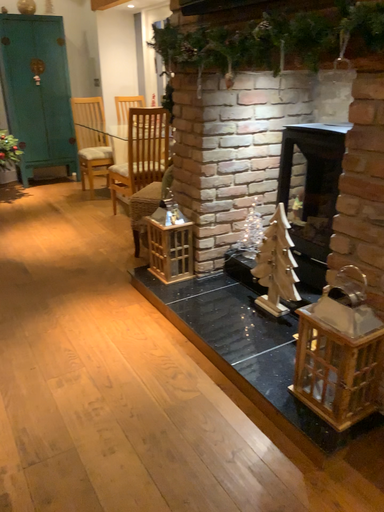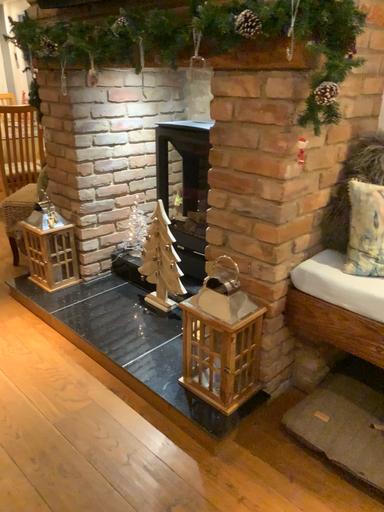
Question: How did the camera likely rotate when shooting the video?

Choices:
 (A) rotated left
 (B) rotated right

Answer: (B)